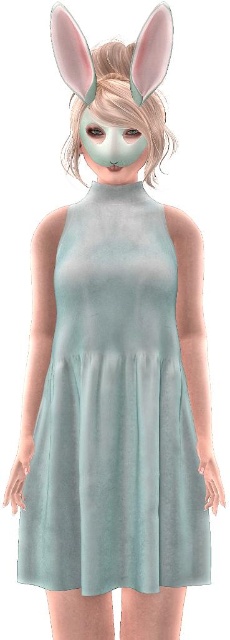
You are a fashion designer observing the image. You need to determine the layering order of the mint fabric dress at center and the matte white mask at center. Which one is visible on top?

The mint fabric dress at center is in front of matte white mask at center, so the dress is visible on top.

You are a costume designer preparing for a play and need to ensure that the mint fabric dress at center and the matte white mask at center fit properly. Which of the two items is larger in size?

The mint fabric dress at center is bigger than the matte white mask at center, so the dress is larger in size.

You are a fashion designer looking at this outfit. The mint fabric dress at center and the matte white mask at center are part of the design. Which one is located to the right of the other?

The mint fabric dress at center is positioned on the right side of matte white mask at center.